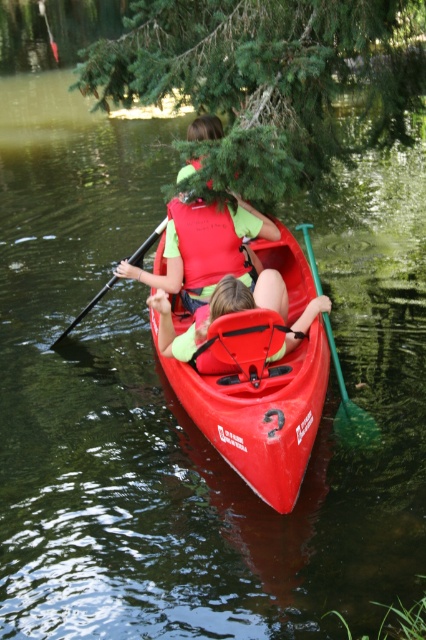
You are a photographer trying to capture a clear shot of the matte green life jacket at center and the green plastic paddle at lower center. Since you want to focus on both objects, which one should you zoom in on first to ensure it fits in the frame?

The matte green life jacket at center is bigger than the green plastic paddle at lower center, so you should zoom in on the green plastic paddle at lower center first to ensure it fits in the frame before adjusting for the larger life jacket.

Consider the image. You are a safety inspector checking the kayak for proper equipment placement. The kayak has a point marked at coordinates (218, 308). According to the scene description, what object is located at that point?

The point at coordinates (218, 308) marks the matte green life vest at center.